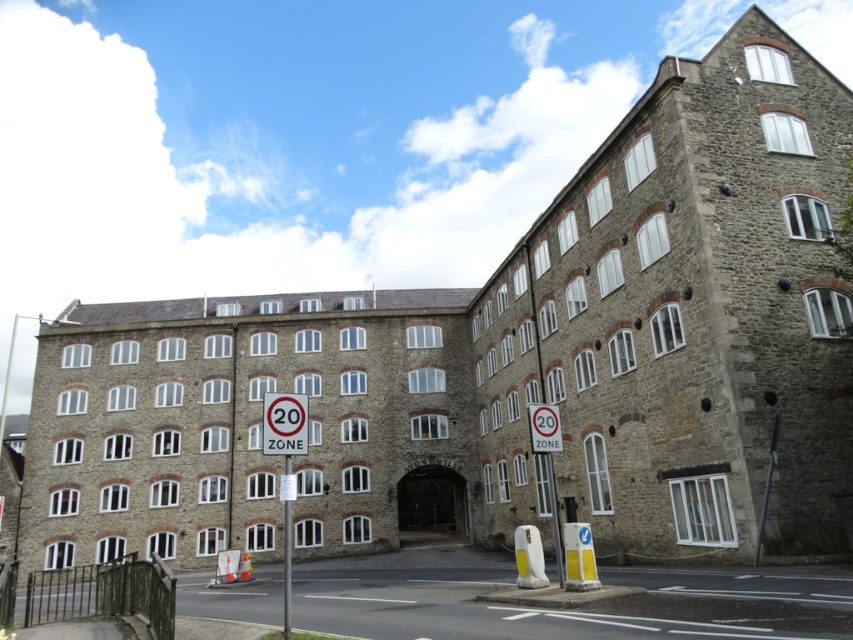
You are a driver approaching the building and see the red plastic sign at center and the metallic silver sign at center on the road. Which sign is taller?

The red plastic sign at center is much taller than the metallic silver sign at center.

You are driving a delivery van that is 2.5 meters wide. You need to pass through the area in front of the building. The road has lane markings and two 20 Zone signs. Can your van fit between the red plastic sign at center and the white plastic pole at lower center without touching them?

The red plastic sign at center is located above the white plastic pole at lower center, so there is no horizontal space between them for the van to pass through. The van would need to go around or find another route.

In the scene shown: You are a driver approaching the intersection near the building and see the red plastic sign at center and the metallic silver sign at center. Which sign is located to the left of the other?

The red plastic sign at center is positioned on the left side of metallic silver sign at center.